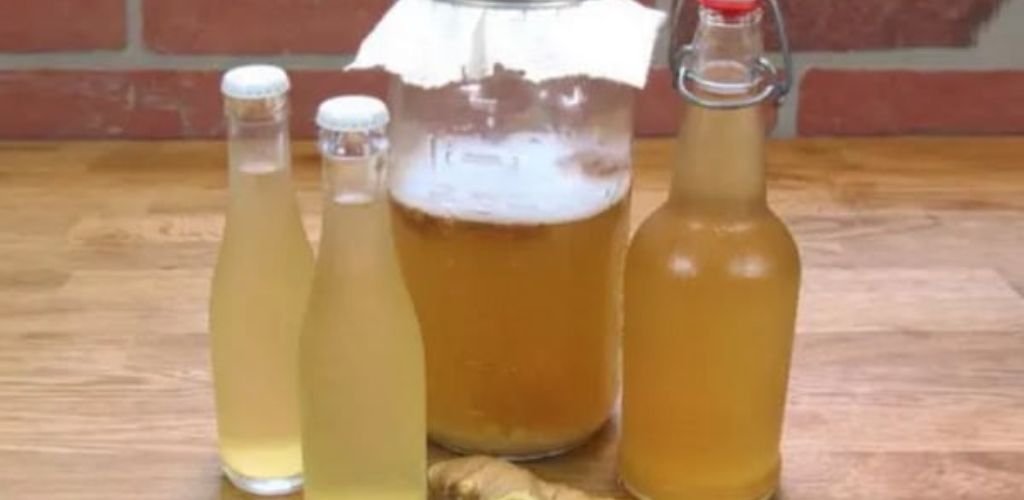
Where is `paper on top of jar`? This screenshot has height=500, width=1024. paper on top of jar is located at coordinates (584, 32).